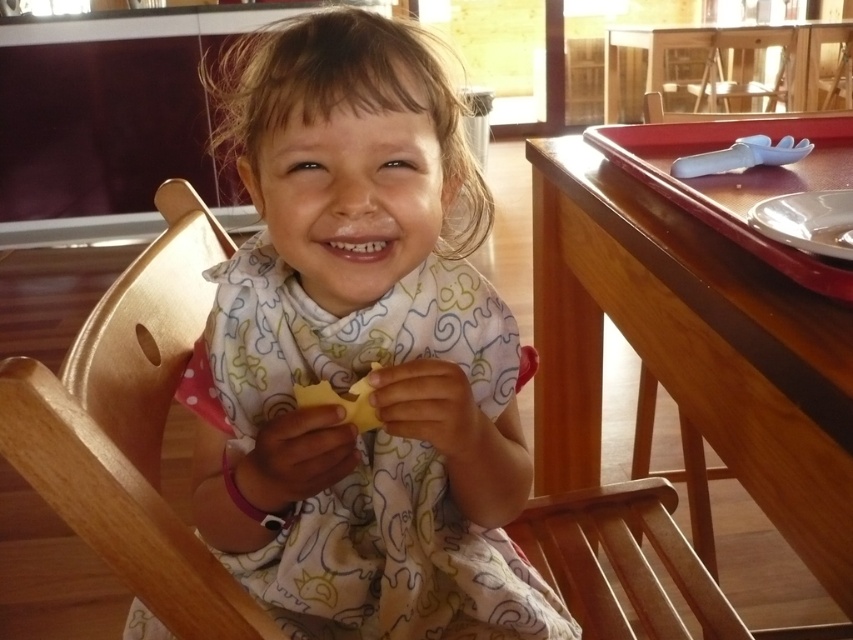
Question: Can you confirm if wooden chair at lower center is positioned to the right of yellow rubbery cheese at center?

Choices:
 (A) no
 (B) yes

Answer: (B)

Question: Which object is closer to the camera taking this photo?

Choices:
 (A) wooden chair at lower center
 (B) wooden highchair at center
 (C) wooden table at right
 (D) white printed bib at center

Answer: (B)

Question: Which of these objects is positioned closest to the wooden table at right?

Choices:
 (A) yellow rubbery cheese at center
 (B) white printed bib at center
 (C) wooden chair at lower center

Answer: (B)

Question: Is wooden table at right closer to camera compared to wooden highchair at center?

Choices:
 (A) yes
 (B) no

Answer: (B)

Question: Which point appears closest to the camera in this image?

Choices:
 (A) (585, 160)
 (B) (370, 403)

Answer: (B)

Question: Is wooden table at right thinner than wooden highchair at center?

Choices:
 (A) no
 (B) yes

Answer: (A)